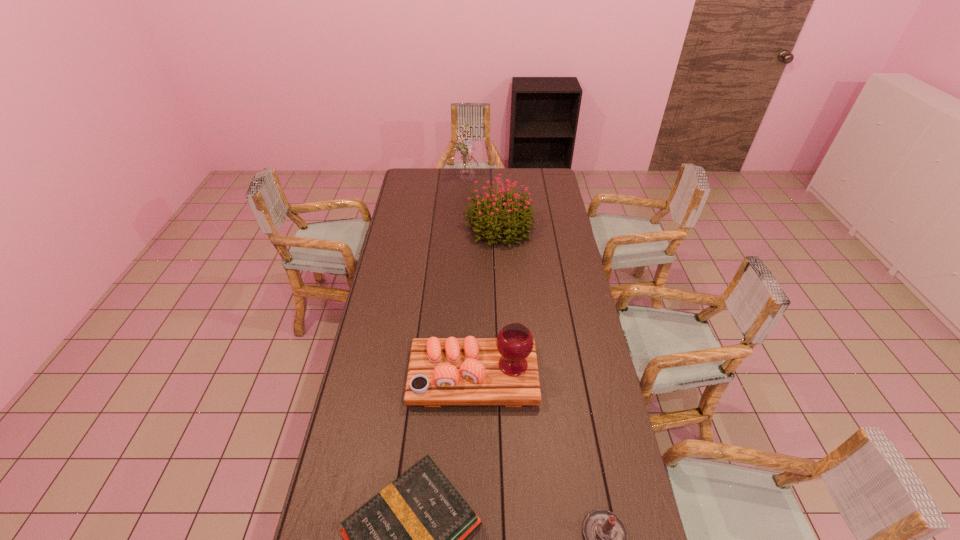
Where is `vacant space that satisfies the following two spatial constraints: 1. on the front-facing side of the farther bouquet; 2. on the right side of the nearer bouquet`? vacant space that satisfies the following two spatial constraints: 1. on the front-facing side of the farther bouquet; 2. on the right side of the nearer bouquet is located at coordinates (466, 227).